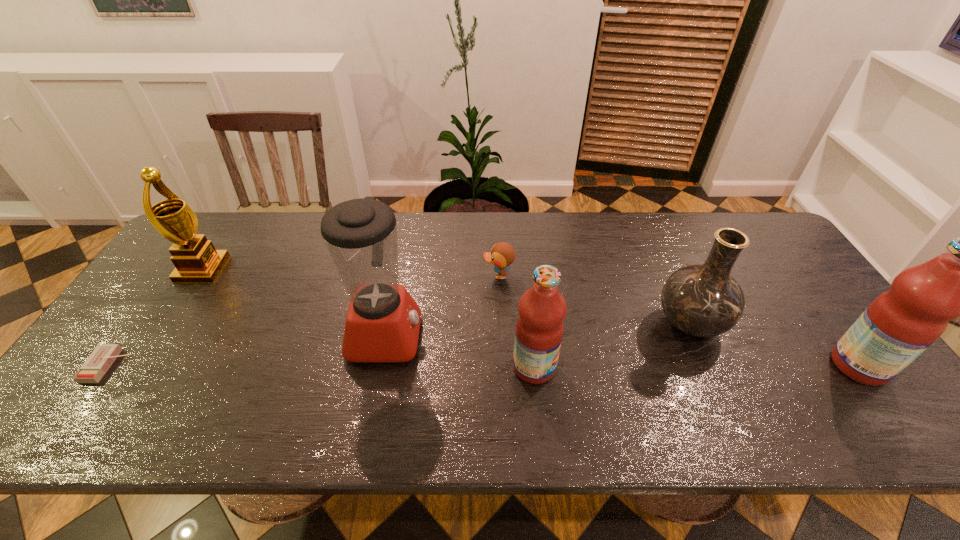
Locate an element on the screen. The width and height of the screenshot is (960, 540). matchbox that is at the left edge is located at coordinates (99, 361).

The width and height of the screenshot is (960, 540). Identify the location of object positioned at the right edge. (901, 323).

At what (x,y) coordinates should I click in order to perform the action: click on object at the far left corner. Please return your answer as a coordinate pair (x, y). Looking at the image, I should click on (196, 260).

Identify the location of object situated at the near left corner. (99, 361).

Locate an element on the screen. Image resolution: width=960 pixels, height=540 pixels. object that is at the near right corner is located at coordinates (901, 323).

You are a GUI agent. You are given a task and a screenshot of the screen. Output one action in this format:
    pyautogui.click(x=<x>, y=<y>)
    Task: Click on the vacant point at the far edge
    
    Given the screenshot: What is the action you would take?
    pyautogui.click(x=238, y=245)

In the image, there is a desktop. Identify the location of free region at the near edge. (734, 394).

Where is `free space at the left edge of the desktop`? The height and width of the screenshot is (540, 960). free space at the left edge of the desktop is located at coordinates (144, 315).

Where is `vacant point at the right edge`? vacant point at the right edge is located at coordinates (828, 325).

The height and width of the screenshot is (540, 960). Find the location of `vacant space at the far left corner of the desktop`. vacant space at the far left corner of the desktop is located at coordinates coord(218,249).